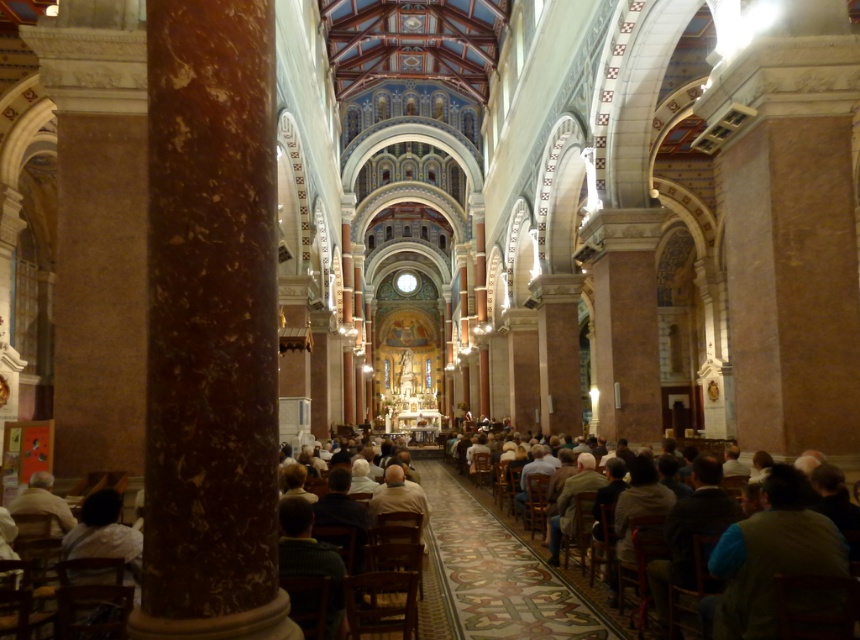
You are a visitor in the church and want to know which object is larger between the brown marble column at left and the light brown leather jacket at lower left. Can you tell me?

The brown marble column at left is bigger than the light brown leather jacket at lower left according to the description.

You are standing at the entrance of the grand church and want to take a photo of the point at coordinates point (255, 276). If your camera has a maximum focus range of 30 meters, will it be able to focus on that point?

The point (255, 276) is 29.14 meters away from the camera, which is within the 30 meter maximum focus range. Therefore, the camera can focus on the point (255, 276).